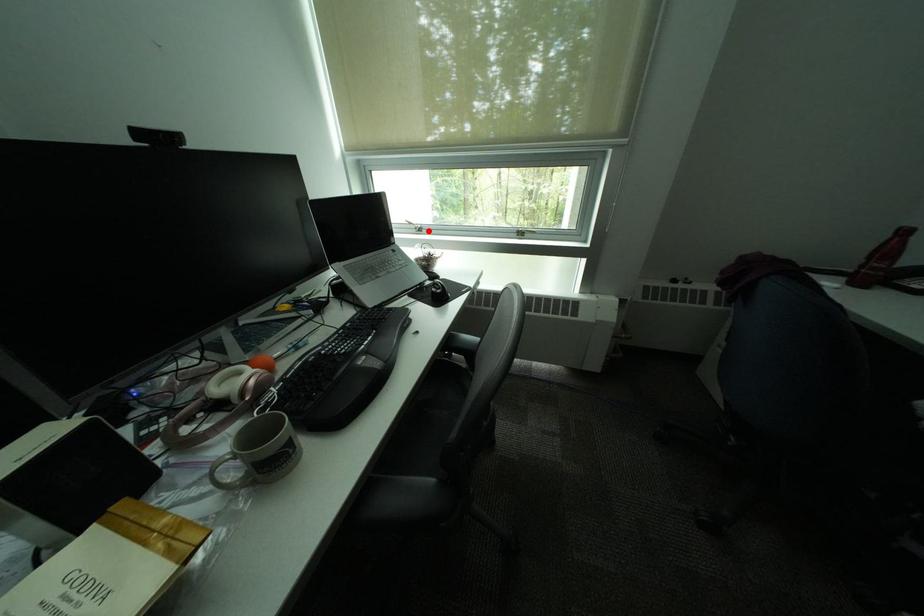
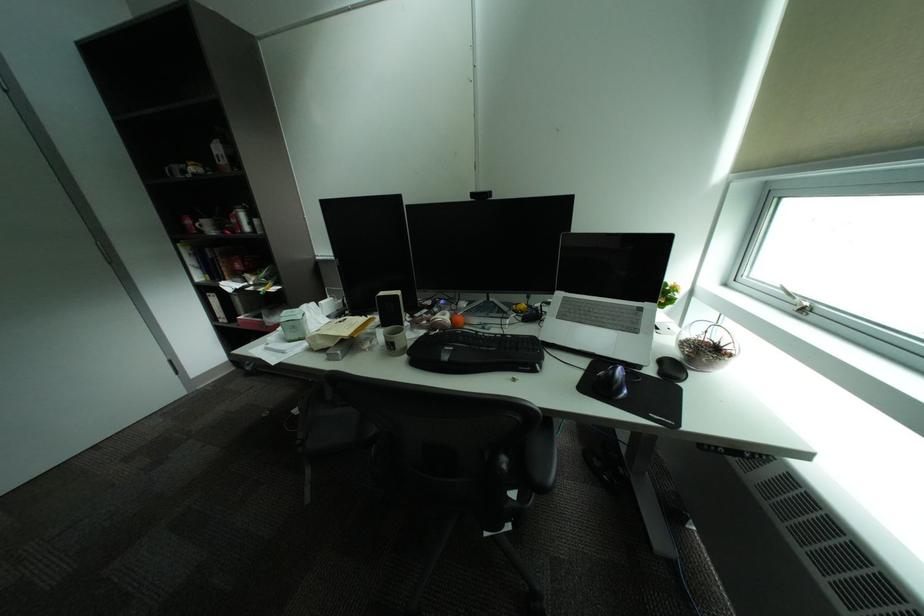
The point at the highlighted location is marked in the first image. Where is the corresponding point in the second image?

(808, 310)